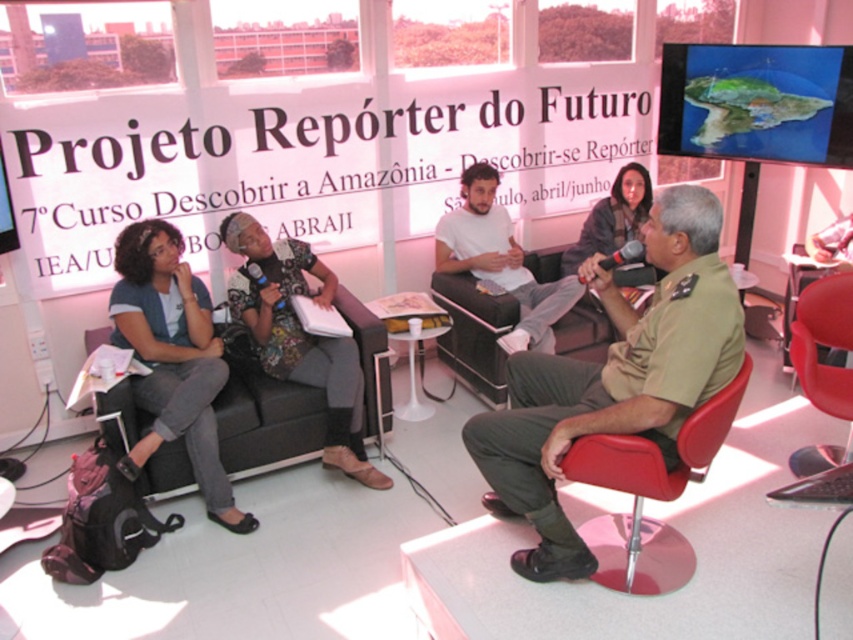
You are a security guard in the room and need to walk from the khaki uniform at center to the matte white shirt at center. How much distance do you need to cover?

The distance between the khaki uniform at center and the matte white shirt at center is 1.36 meters, so you need to cover 1.36 meters.

You are an event organizer who needs to ensure all participants have enough space. Given the khaki uniform at center and the red leather chair at lower right, which object takes up more space in the scene?

The khaki uniform at center is bigger than the red leather chair at lower right, so it takes up more space in the scene.

Based on the coordinates provided, which of the two points, point A at (677, 200) or point B at (584, 445), is located further away from the speaker?

Point A at (677, 200) is located further away from the speaker.